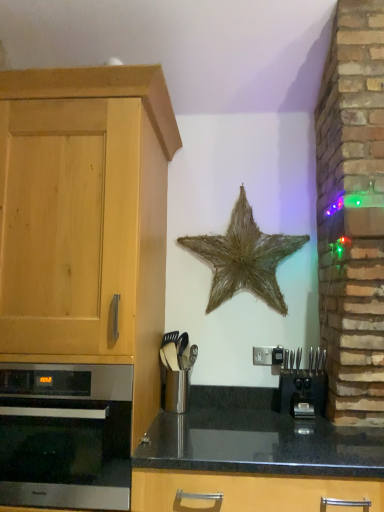
The width and height of the screenshot is (384, 512). Identify the location of empty space that is ontop of rustic straw star at center (from a real-world perspective). (235, 183).